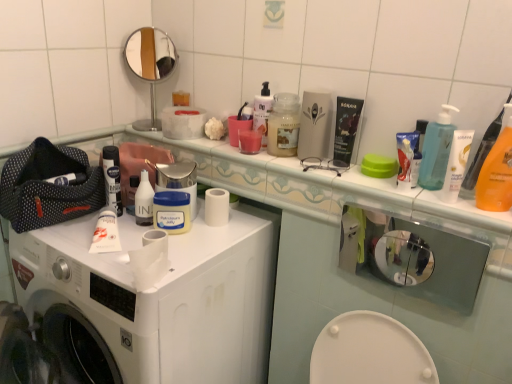
Identify the location of free point behind white matte toilet paper at center. (178, 245).